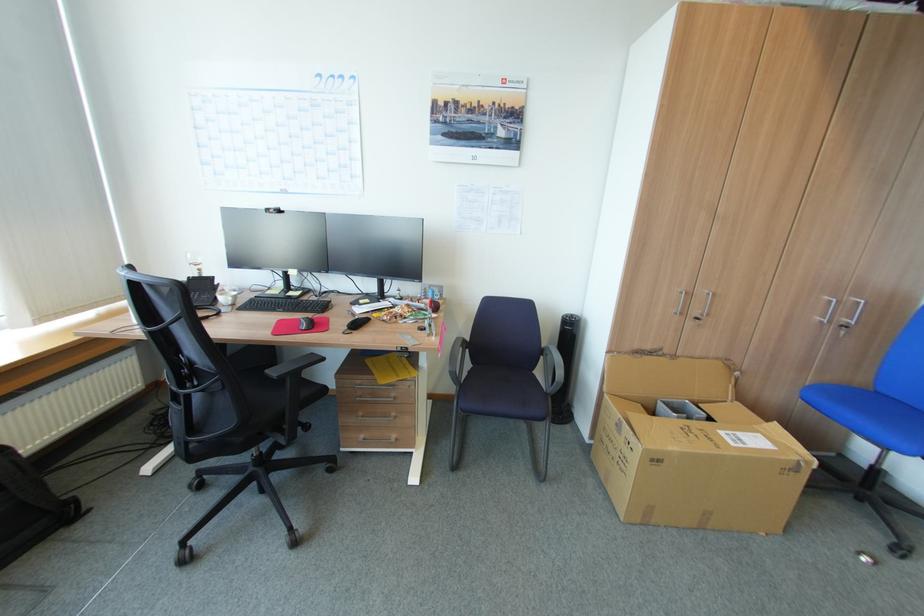
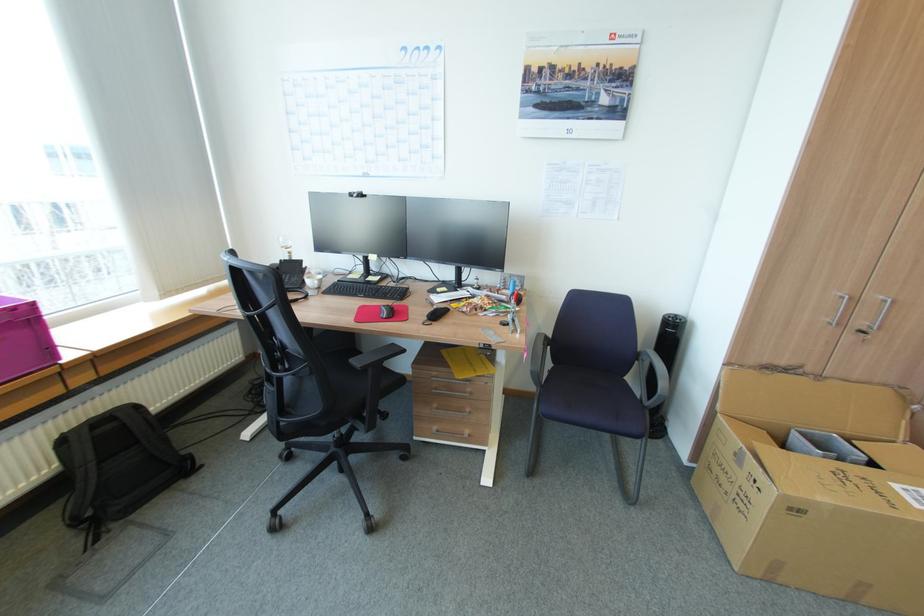
In the second image, find the point that corresponds to point (261, 297) in the first image.

(344, 281)